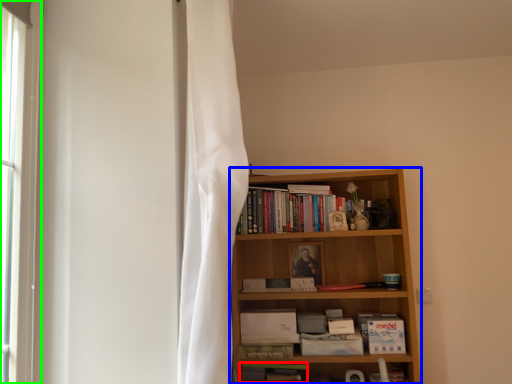
Question: Estimate the real-world distances between objects in this image. Which object is closer to book (highlighted by a red box), bookcase (highlighted by a blue box) or bay window (highlighted by a green box)?

Choices:
 (A) bookcase
 (B) bay window

Answer: (A)